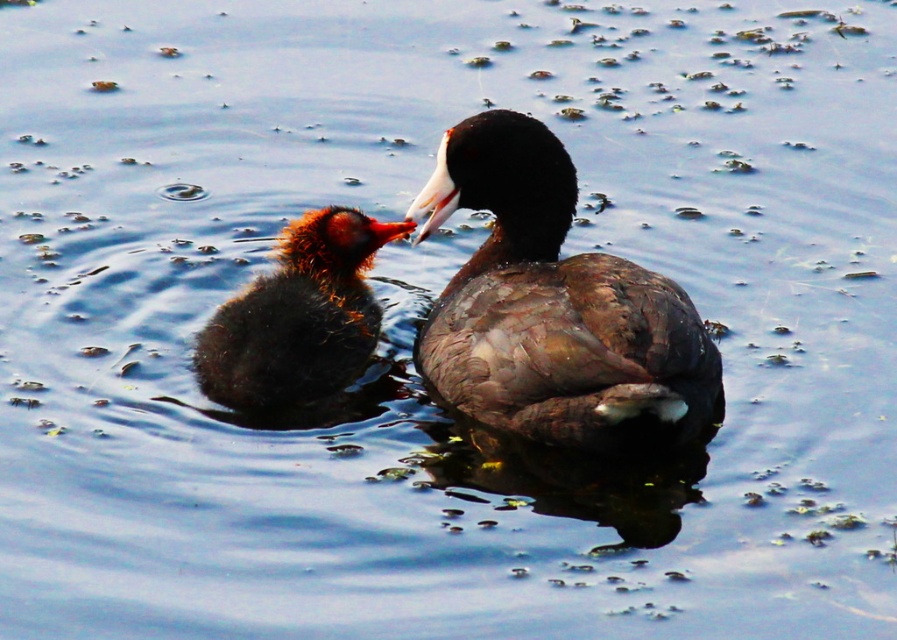
Which of these two, brown feathered duckling at center or brown downy duckling at center, stands taller?

Standing taller between the two is brown feathered duckling at center.

Which is above, brown feathered duckling at center or brown downy duckling at center?

brown feathered duckling at center

Consider the image. Who is more distant from viewer, [641,385] or [210,317]?

Point [210,317]

Where is `brown feathered duckling at center`? Image resolution: width=897 pixels, height=640 pixels. brown feathered duckling at center is located at coordinates (554, 308).